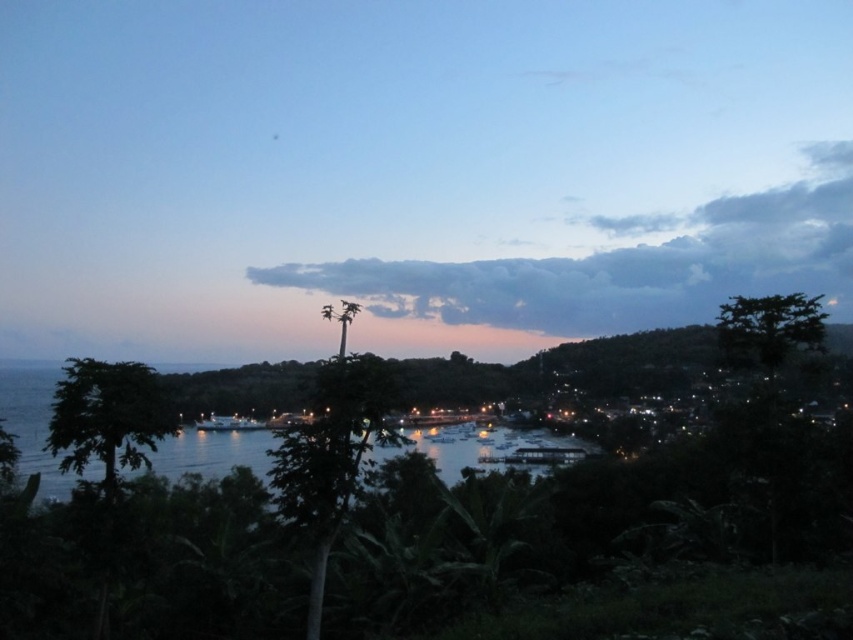
You are standing at the edge of the water in the coastal scene and want to walk to the point labeled point (323, 509). There is another point labeled point (62, 451) in the distance. Which point is closer to you?

Point (323, 509) is closer to the viewer than point (62, 451), so you are closer to point (323, 509).